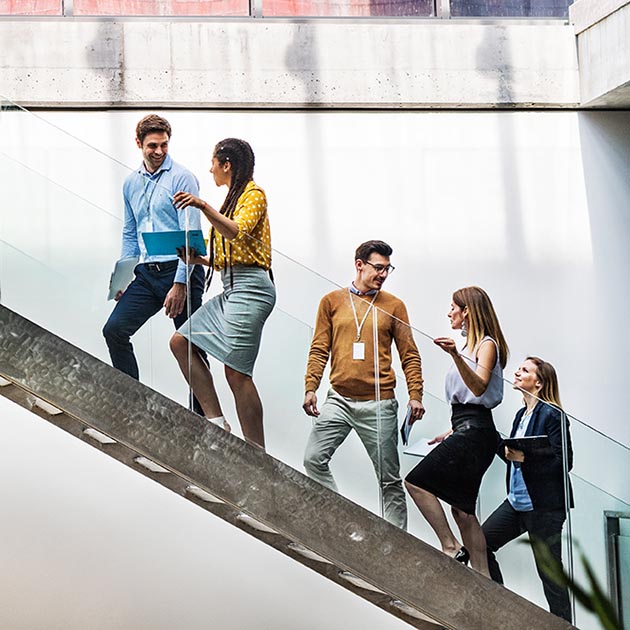
In order to click on glass panes in this screenshot , I will do `click(29, 248)`, `click(92, 302)`, `click(287, 391)`, `click(276, 358)`, `click(427, 421)`, `click(464, 453)`, `click(576, 523)`, `click(598, 536)`.